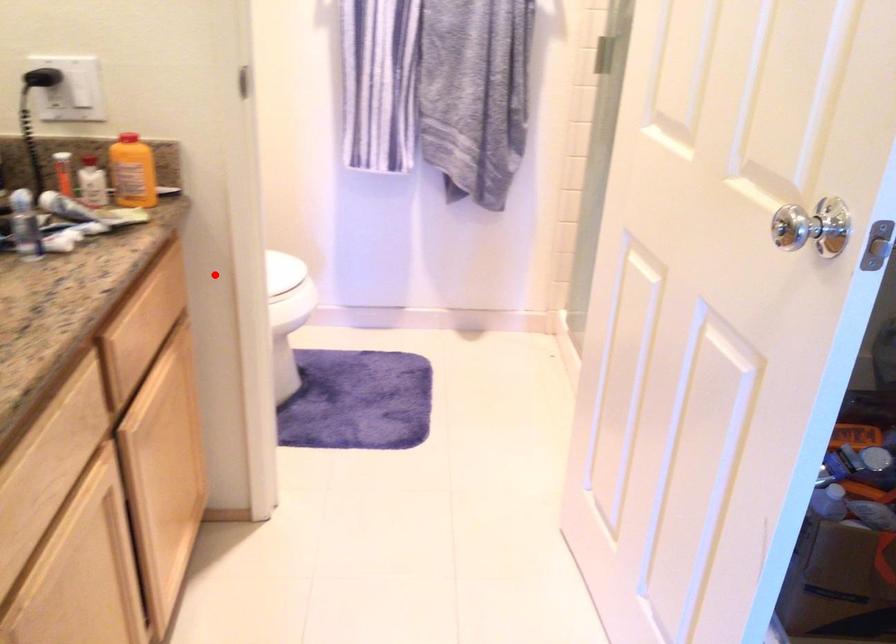
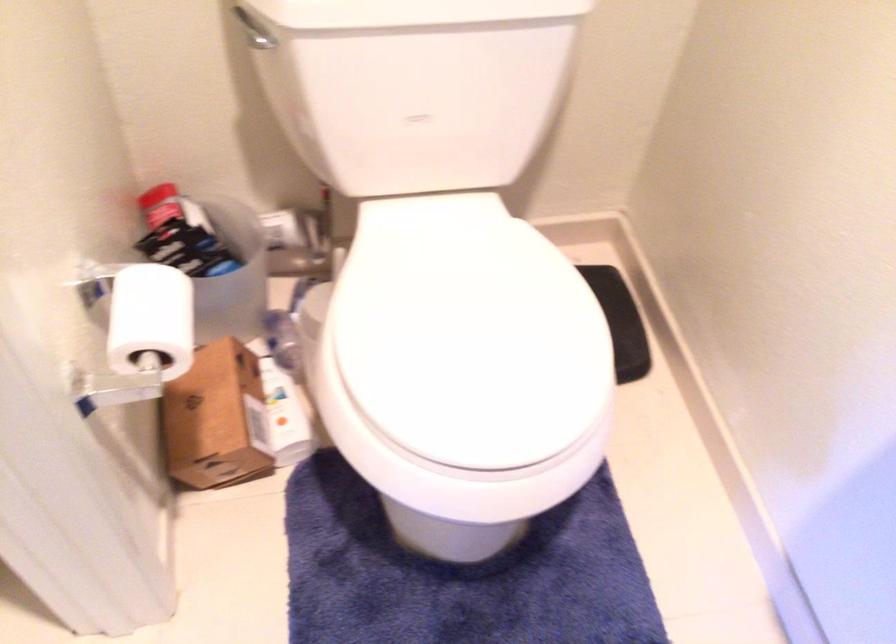
In the second image, find the point that corresponds to the highlighted location in the first image.

(151, 319)